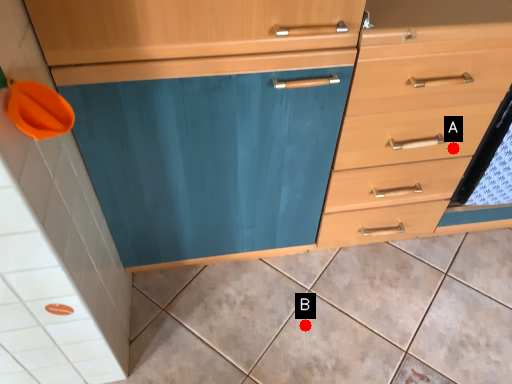
Question: Two points are circled on the image, labeled by A and B beside each circle. Among these points, which one is farthest from the camera?

Choices:
 (A) A is further
 (B) B is further

Answer: (B)